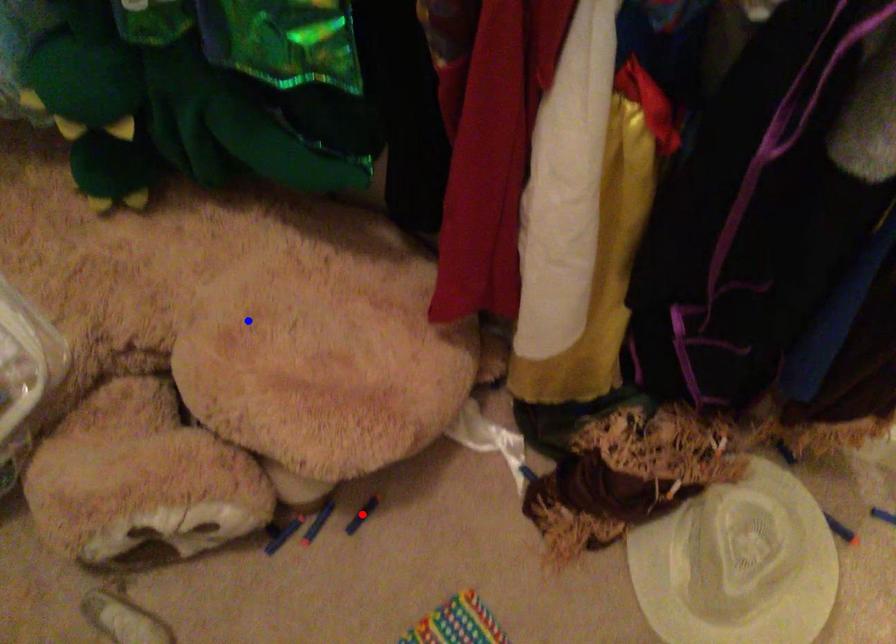
Question: Two points are marked on the image. Which point is closer to the camera?

Choices:
 (A) Blue point is closer.
 (B) Red point is closer.

Answer: (A)